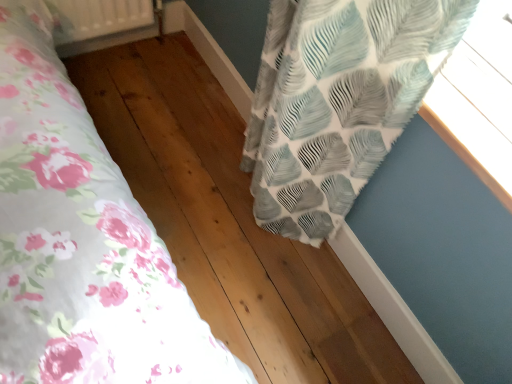
What do you see at coordinates (98, 17) in the screenshot? I see `white plastic radiator at upper left` at bounding box center [98, 17].

Find the location of `white plastic radiator at upper left`. white plastic radiator at upper left is located at coordinates (98, 17).

Is white plastic radiator at upper left positioned beyond the bounds of textured white and blue leaf-patterned curtain at upper right?

That's correct, white plastic radiator at upper left is outside of textured white and blue leaf-patterned curtain at upper right.

Does white plastic radiator at upper left lie in front of textured white and blue leaf-patterned curtain at upper right?

No, white plastic radiator at upper left is behind textured white and blue leaf-patterned curtain at upper right.

Does white plastic radiator at upper left have a larger size compared to textured white and blue leaf-patterned curtain at upper right?

No, white plastic radiator at upper left is not bigger than textured white and blue leaf-patterned curtain at upper right.

In terms of width, does white plastic radiator at upper left look wider or thinner when compared to textured fabric curtain at upper right?

Clearly, white plastic radiator at upper left has less width compared to textured fabric curtain at upper right.

Looking at this image, visually, is white plastic radiator at upper left positioned to the left or to the right of textured fabric curtain at upper right?

In the image, white plastic radiator at upper left appears on the left side of textured fabric curtain at upper right.

How distant is white plastic radiator at upper left from textured fabric curtain at upper right?

A distance of 4.53 feet exists between white plastic radiator at upper left and textured fabric curtain at upper right.

From the image's perspective, is white plastic radiator at upper left above textured fabric curtain at upper right?

Yes, from the image's perspective, white plastic radiator at upper left is above textured fabric curtain at upper right.

Is textured white and blue leaf-patterned curtain at upper right positioned with its back to textured fabric curtain at upper right?

No.

Can you confirm if textured white and blue leaf-patterned curtain at upper right is taller than textured fabric curtain at upper right?

Correct, textured white and blue leaf-patterned curtain at upper right is much taller as textured fabric curtain at upper right.

Does point (462, 129) come farther from viewer compared to point (63, 5)?

No.

From a real-world perspective, is textured fabric curtain at upper right beneath white plastic radiator at upper left?

Incorrect, from a real-world perspective, textured fabric curtain at upper right is higher than white plastic radiator at upper left.

Based on the photo, considering the relative positions of textured fabric curtain at upper right and white plastic radiator at upper left in the image provided, is textured fabric curtain at upper right to the left or to the right of white plastic radiator at upper left?

Clearly, textured fabric curtain at upper right is on the right of white plastic radiator at upper left in the image.

From a real-world perspective, which object stands above the other?

textured white and blue leaf-patterned curtain at upper right is physically above.

Considering the positions of objects textured white and blue leaf-patterned curtain at upper right and white plastic radiator at upper left in the image provided, who is more to the right, textured white and blue leaf-patterned curtain at upper right or white plastic radiator at upper left?

From the viewer's perspective, textured white and blue leaf-patterned curtain at upper right appears more on the right side.

Where is `radiator located above the textured white and blue leaf-patterned curtain at upper right (from the image's perspective)`? The width and height of the screenshot is (512, 384). radiator located above the textured white and blue leaf-patterned curtain at upper right (from the image's perspective) is located at coordinates (x=98, y=17).

Which object is further away from the camera, textured white and blue leaf-patterned curtain at upper right or white plastic radiator at upper left?

Positioned behind is white plastic radiator at upper left.

Between textured fabric curtain at upper right and textured white and blue leaf-patterned curtain at upper right, which one has smaller size?

textured white and blue leaf-patterned curtain at upper right is smaller.

This screenshot has width=512, height=384. Identify the location of window that is in front of the textured white and blue leaf-patterned curtain at upper right. (478, 98).

Where is `curtain in front of the white plastic radiator at upper left`? The image size is (512, 384). curtain in front of the white plastic radiator at upper left is located at coordinates (338, 101).

At what (x,y) coordinates should I click in order to perform the action: click on window on the right of white plastic radiator at upper left. Please return your answer as a coordinate pair (x, y). Looking at the image, I should click on (478, 98).

Based on their spatial positions, is white plastic radiator at upper left or textured fabric curtain at upper right further from textured white and blue leaf-patterned curtain at upper right?

Based on the image, white plastic radiator at upper left appears to be further to textured white and blue leaf-patterned curtain at upper right.

When comparing their distances from textured fabric curtain at upper right, does white plastic radiator at upper left or textured white and blue leaf-patterned curtain at upper right seem further?

white plastic radiator at upper left lies further to textured fabric curtain at upper right than the other object.

When comparing their distances from white plastic radiator at upper left, does textured fabric curtain at upper right or textured white and blue leaf-patterned curtain at upper right seem closer?

textured white and blue leaf-patterned curtain at upper right.

In the scene shown: Which object lies nearer to the anchor point white plastic radiator at upper left, textured white and blue leaf-patterned curtain at upper right or textured fabric curtain at upper right?

Based on the image, textured white and blue leaf-patterned curtain at upper right appears to be nearer to white plastic radiator at upper left.

Looking at the image, which one is located further to textured white and blue leaf-patterned curtain at upper right, textured fabric curtain at upper right or white plastic radiator at upper left?

white plastic radiator at upper left.

Considering their positions, is textured white and blue leaf-patterned curtain at upper right positioned closer to textured fabric curtain at upper right than white plastic radiator at upper left?

textured white and blue leaf-patterned curtain at upper right lies closer to textured fabric curtain at upper right than the other object.

At what (x,y) coordinates should I click in order to perform the action: click on curtain situated between white plastic radiator at upper left and textured fabric curtain at upper right from left to right. Please return your answer as a coordinate pair (x, y). This screenshot has width=512, height=384. Looking at the image, I should click on (338, 101).